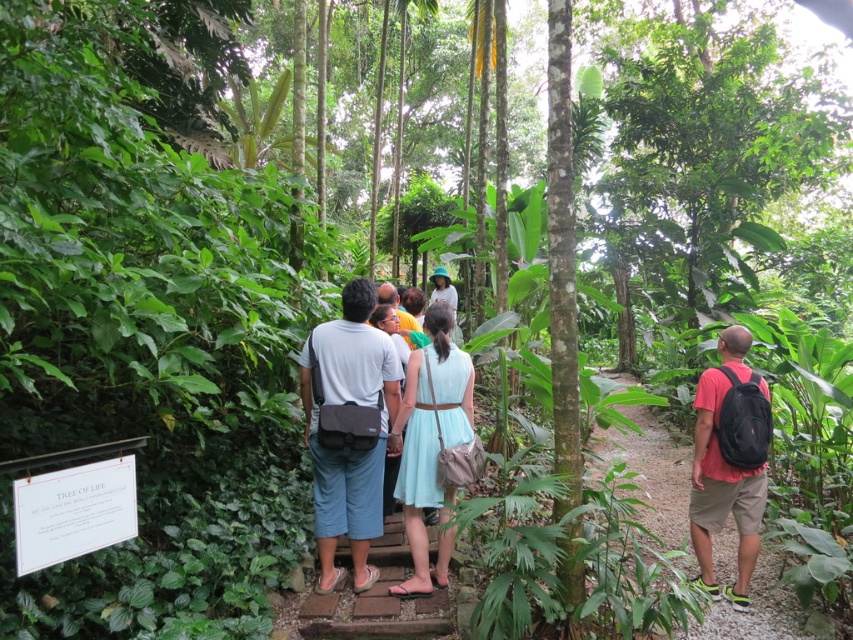
Question: Which is farther from the light blue fabric dress at center?

Choices:
 (A) red backpack at right
 (B) matte black backpack at right
 (C) gray fabric bag at center

Answer: (A)

Question: Which of the following is the closest to the observer?

Choices:
 (A) light blue fabric dress at center
 (B) matte black backpack at right

Answer: (A)

Question: Can you confirm if red backpack at right is positioned below light blue fabric dress at center?

Choices:
 (A) yes
 (B) no

Answer: (A)

Question: Can you confirm if gray fabric bag at center is bigger than matte black backpack at right?

Choices:
 (A) yes
 (B) no

Answer: (B)

Question: Can you confirm if gray fabric bag at center is wider than light blue fabric dress at center?

Choices:
 (A) yes
 (B) no

Answer: (A)

Question: Which object appears farthest from the camera in this image?

Choices:
 (A) gray fabric bag at center
 (B) light blue fabric dress at center

Answer: (A)